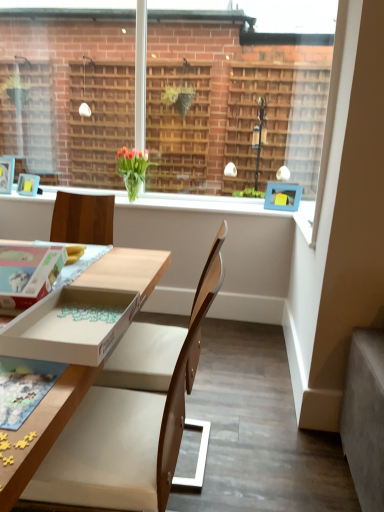
Question: Considering the relative sizes of cardboard box at lower left, arranged as the 2th box when viewed from the right, and white cardboard box at lower left, arranged as the second box when viewed from the left, in the image provided, is cardboard box at lower left, arranged as the 2th box when viewed from the right, thinner than white cardboard box at lower left, arranged as the second box when viewed from the left,?

Choices:
 (A) yes
 (B) no

Answer: (A)

Question: Is cardboard box at lower left, placed as the 1th box when sorted from left to right, taller than white cardboard box at lower left, arranged as the second box when viewed from the left?

Choices:
 (A) no
 (B) yes

Answer: (B)

Question: Is cardboard box at lower left, arranged as the 2th box when viewed from the right, bigger than white cardboard box at lower left, arranged as the second box when viewed from the left?

Choices:
 (A) no
 (B) yes

Answer: (B)

Question: Does cardboard box at lower left, placed as the 1th box when sorted from left to right, turn towards white cardboard box at lower left, arranged as the second box when viewed from the left?

Choices:
 (A) yes
 (B) no

Answer: (B)

Question: Is cardboard box at lower left, placed as the 1th box when sorted from left to right, with white cardboard box at lower left, arranged as the second box when viewed from the left?

Choices:
 (A) yes
 (B) no

Answer: (B)

Question: Are cardboard box at lower left, placed as the 1th box when sorted from left to right, and white cardboard box at lower left, the first box when ordered from right to left, far apart?

Choices:
 (A) no
 (B) yes

Answer: (A)

Question: From the image's perspective, is cardboard box at lower left, placed as the 1th box when sorted from left to right, located above translucent glass vase at upper center?

Choices:
 (A) yes
 (B) no

Answer: (B)

Question: Does cardboard box at lower left, arranged as the 2th box when viewed from the right, come in front of translucent glass vase at upper center?

Choices:
 (A) no
 (B) yes

Answer: (B)

Question: Does cardboard box at lower left, placed as the 1th box when sorted from left to right, turn towards translucent glass vase at upper center?

Choices:
 (A) yes
 (B) no

Answer: (A)

Question: Is cardboard box at lower left, arranged as the 2th box when viewed from the right, turned away from translucent glass vase at upper center?

Choices:
 (A) yes
 (B) no

Answer: (B)

Question: Considering the relative sizes of cardboard box at lower left, placed as the 1th box when sorted from left to right, and translucent glass vase at upper center in the image provided, is cardboard box at lower left, placed as the 1th box when sorted from left to right, bigger than translucent glass vase at upper center?

Choices:
 (A) yes
 (B) no

Answer: (B)

Question: Is cardboard box at lower left, placed as the 1th box when sorted from left to right, outside translucent glass vase at upper center?

Choices:
 (A) yes
 (B) no

Answer: (A)

Question: From a real-world perspective, is wooden chair at center over white cardboard box at lower left, the first box when ordered from right to left?

Choices:
 (A) no
 (B) yes

Answer: (A)